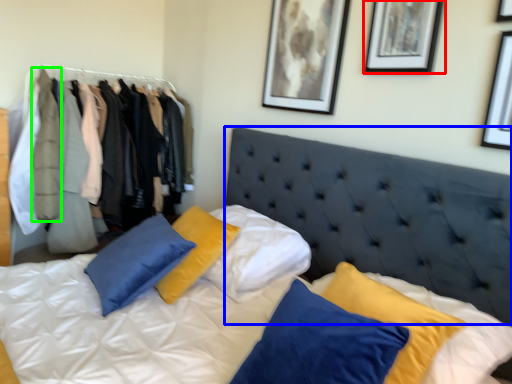
Question: Which object is the farthest from picture frame (highlighted by a red box)? Choose among these: headboard (highlighted by a blue box) or clothing (highlighted by a green box).

Choices:
 (A) headboard
 (B) clothing

Answer: (B)